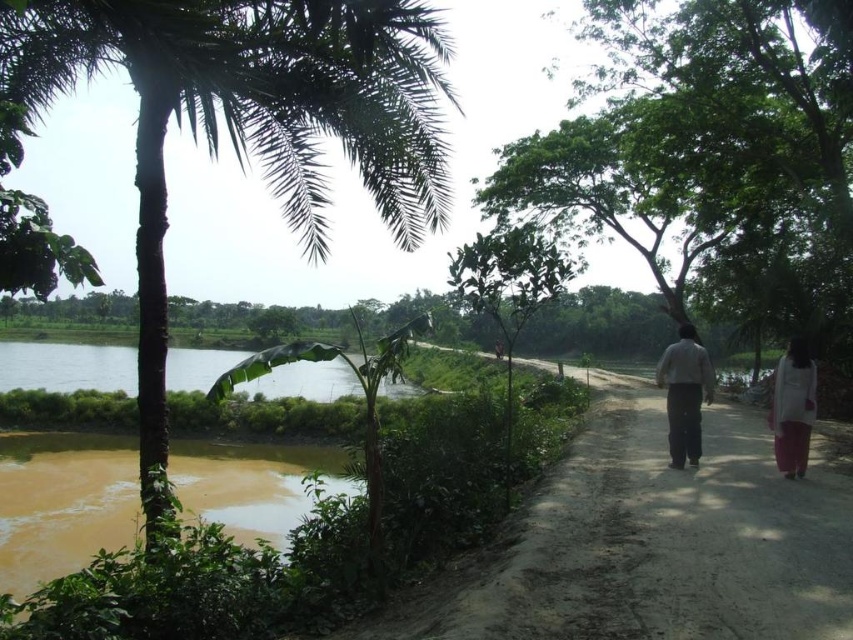
Question: Considering the relative positions of light gray cotton pants at right and white cotton dress at right in the image provided, where is light gray cotton pants at right located with respect to white cotton dress at right?

Choices:
 (A) left
 (B) right

Answer: (B)

Question: Which object appears farthest from the camera in this image?

Choices:
 (A) dirt road at center
 (B) white cotton dress at right
 (C) light gray cotton pants at right

Answer: (C)

Question: Does light gray cotton pants at right have a lesser width compared to white cotton dress at right?

Choices:
 (A) no
 (B) yes

Answer: (A)

Question: Which of these objects is positioned farthest from the green leafy palm tree at left?

Choices:
 (A) green leafy tree at center
 (B) light gray cotton pants at right

Answer: (A)

Question: Which object appears closest to the camera in this image?

Choices:
 (A) dirt road at center
 (B) light gray cotton pants at right
 (C) dark gray pants at center
 (D) green leafy palm tree at left

Answer: (A)

Question: Is green leafy tree at center below light gray cotton pants at right?

Choices:
 (A) no
 (B) yes

Answer: (A)